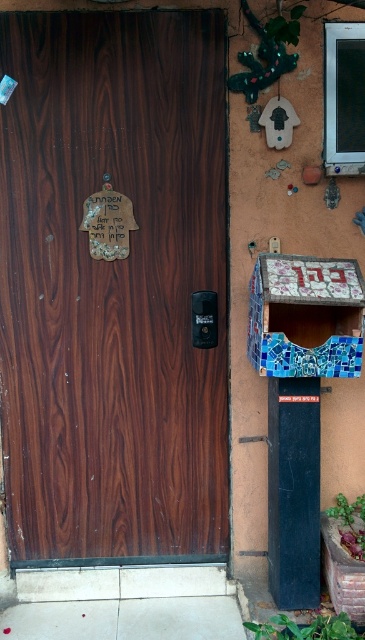
Between mosaic tile bulletin board at right and black plastic phone box at center, which one appears on the left side from the viewer's perspective?

black plastic phone box at center is more to the left.

Find the location of `mosaic tile bulletin board at right`. mosaic tile bulletin board at right is located at coordinates [308, 314].

Can you confirm if brown wood door at center is positioned to the left of black plastic phone box at center?

Correct, you'll find brown wood door at center to the left of black plastic phone box at center.

Between brown wood door at center and black plastic phone box at center, which one has less height?

black plastic phone box at center

Where is `brown wood door at center`? Image resolution: width=365 pixels, height=640 pixels. brown wood door at center is located at coordinates (113, 285).

You are a GUI agent. You are given a task and a screenshot of the screen. Output one action in this format:
    pyautogui.click(x=<x>, y=<y>)
    Task: Click on the brown wood door at center
    This screenshot has width=365, height=640.
    Given the screenshot: What is the action you would take?
    pyautogui.click(x=113, y=285)

Who is more forward, (24,81) or (247,353)?

Point (24,81) is in front.

From the picture: Between brown wood door at center and mosaic tile bulletin board at right, which one appears on the left side from the viewer's perspective?

From the viewer's perspective, brown wood door at center appears more on the left side.

Where is `brown wood door at center`? Image resolution: width=365 pixels, height=640 pixels. brown wood door at center is located at coordinates (113, 285).